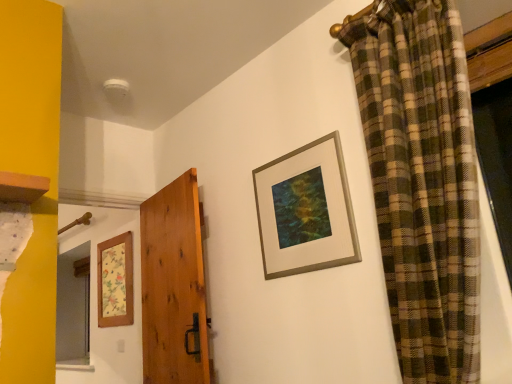
The width and height of the screenshot is (512, 384). What do you see at coordinates (174, 286) in the screenshot?
I see `natural wood door at center` at bounding box center [174, 286].

What do you see at coordinates (307, 210) in the screenshot? I see `gold metallic picture frame at upper center, marked as the 1th picture frame in a right-to-left arrangement` at bounding box center [307, 210].

What are the coordinates of `wooden floral-patterned picture frame at left, the 1th picture frame positioned from the bottom` in the screenshot? It's located at (115, 281).

This screenshot has width=512, height=384. I want to click on natural wood door at center, so click(x=174, y=286).

Is gold metallic picture frame at upper center, which is the 1th picture frame from top to bottom, surrounding natural wood door at center?

Definitely not — natural wood door at center is not inside gold metallic picture frame at upper center, which is the 1th picture frame from top to bottom.

You are a GUI agent. You are given a task and a screenshot of the screen. Output one action in this format:
    pyautogui.click(x=<x>, y=<y>)
    Task: Click on the door below the gold metallic picture frame at upper center, acting as the first picture frame starting from the front (from a real-world perspective)
    This screenshot has width=512, height=384.
    Given the screenshot: What is the action you would take?
    pyautogui.click(x=174, y=286)

Is gold metallic picture frame at upper center, which is the 1th picture frame from top to bottom, facing away from natural wood door at center?

That's not correct — gold metallic picture frame at upper center, which is the 1th picture frame from top to bottom, is not looking away from natural wood door at center.

Considering the relative sizes of gold metallic picture frame at upper center, the 2th picture frame from the left, and natural wood door at center in the image provided, is gold metallic picture frame at upper center, the 2th picture frame from the left, thinner than natural wood door at center?

Yes, gold metallic picture frame at upper center, the 2th picture frame from the left, is thinner than natural wood door at center.

Considering the relative sizes of natural wood door at center and wooden floral-patterned picture frame at left, the second picture frame in the front-to-back sequence, in the image provided, is natural wood door at center smaller than wooden floral-patterned picture frame at left, the second picture frame in the front-to-back sequence,?

Incorrect, natural wood door at center is not smaller in size than wooden floral-patterned picture frame at left, the second picture frame in the front-to-back sequence.

From the picture: Is natural wood door at center at the left side of wooden floral-patterned picture frame at left, the second picture frame in the front-to-back sequence?

In fact, natural wood door at center is to the right of wooden floral-patterned picture frame at left, the second picture frame in the front-to-back sequence.

Measure the distance between natural wood door at center and wooden floral-patterned picture frame at left, the 1th picture frame positioned from the left.

natural wood door at center is 23.34 inches away from wooden floral-patterned picture frame at left, the 1th picture frame positioned from the left.

Are natural wood door at center and wooden floral-patterned picture frame at left, the 1th picture frame positioned from the bottom, beside each other?

They are not placed beside each other.

Between wooden floral-patterned picture frame at left, the 1th picture frame positioned from the bottom, and natural wood door at center, which one has more height?

Standing taller between the two is natural wood door at center.

Based on the photo, considering the sizes of wooden floral-patterned picture frame at left, the 1th picture frame positioned from the back, and natural wood door at center in the image, is wooden floral-patterned picture frame at left, the 1th picture frame positioned from the back, wider or thinner than natural wood door at center?

Clearly, wooden floral-patterned picture frame at left, the 1th picture frame positioned from the back, has less width compared to natural wood door at center.

Considering the points (102, 317) and (169, 272), which point is behind, point (102, 317) or point (169, 272)?

The point (102, 317) is farther from the camera.

From the picture: Is gold metallic picture frame at upper center, marked as the 1th picture frame in a right-to-left arrangement, turned away from wooden floral-patterned picture frame at left, which ranks as the second picture frame in top-to-bottom order?

No.

What's the angular difference between gold metallic picture frame at upper center, the 2th picture frame from the left, and wooden floral-patterned picture frame at left, the 1th picture frame positioned from the back,'s facing directions?

They differ by 0.625 degrees in their facing directions.

Is gold metallic picture frame at upper center, acting as the first picture frame starting from the front, to the right of wooden floral-patterned picture frame at left, the second picture frame in the front-to-back sequence, from the viewer's perspective?

Indeed, gold metallic picture frame at upper center, acting as the first picture frame starting from the front, is positioned on the right side of wooden floral-patterned picture frame at left, the second picture frame in the front-to-back sequence.

Considering the relative sizes of gold metallic picture frame at upper center, marked as the 1th picture frame in a right-to-left arrangement, and wooden floral-patterned picture frame at left, which ranks as the second picture frame in top-to-bottom order, in the image provided, is gold metallic picture frame at upper center, marked as the 1th picture frame in a right-to-left arrangement, bigger than wooden floral-patterned picture frame at left, which ranks as the second picture frame in top-to-bottom order,?

No.

Is natural wood door at center positioned far away from gold metallic picture frame at upper center, the 2th picture frame positioned from the bottom?

Actually, natural wood door at center and gold metallic picture frame at upper center, the 2th picture frame positioned from the bottom, are a little close together.

From the image's perspective, is natural wood door at center located above gold metallic picture frame at upper center, which is the 1th picture frame from top to bottom?

No, from the image's perspective, natural wood door at center is not over gold metallic picture frame at upper center, which is the 1th picture frame from top to bottom.

Based on their sizes in the image, would you say natural wood door at center is bigger or smaller than gold metallic picture frame at upper center, the 2th picture frame from the left?

Considering their sizes, natural wood door at center takes up more space than gold metallic picture frame at upper center, the 2th picture frame from the left.

Can you confirm if natural wood door at center is taller than gold metallic picture frame at upper center, the 2th picture frame positioned from the bottom?

Yes, natural wood door at center is taller than gold metallic picture frame at upper center, the 2th picture frame positioned from the bottom.

Based on the photo, how many degrees apart are the facing directions of wooden floral-patterned picture frame at left, the second picture frame in the front-to-back sequence, and gold metallic picture frame at upper center, the 2th picture frame positioned from the bottom?

0.625 degrees separate the facing orientations of wooden floral-patterned picture frame at left, the second picture frame in the front-to-back sequence, and gold metallic picture frame at upper center, the 2th picture frame positioned from the bottom.

Considering the positions of objects wooden floral-patterned picture frame at left, the second picture frame in the front-to-back sequence, and gold metallic picture frame at upper center, the 2th picture frame from the left, in the image provided, who is more to the right, wooden floral-patterned picture frame at left, the second picture frame in the front-to-back sequence, or gold metallic picture frame at upper center, the 2th picture frame from the left,?

Positioned to the right is gold metallic picture frame at upper center, the 2th picture frame from the left.

Can you confirm if wooden floral-patterned picture frame at left, which is the second picture frame in right-to-left order, is taller than gold metallic picture frame at upper center, the 2th picture frame positioned from the bottom?

Correct, wooden floral-patterned picture frame at left, which is the second picture frame in right-to-left order, is much taller as gold metallic picture frame at upper center, the 2th picture frame positioned from the bottom.

Is wooden floral-patterned picture frame at left, which is the second picture frame in right-to-left order, oriented towards gold metallic picture frame at upper center, the 2th picture frame from the left?

No, wooden floral-patterned picture frame at left, which is the second picture frame in right-to-left order, is not oriented towards gold metallic picture frame at upper center, the 2th picture frame from the left.

Where is `door below the gold metallic picture frame at upper center, which is the 1th picture frame from top to bottom (from a real-world perspective)`? This screenshot has width=512, height=384. door below the gold metallic picture frame at upper center, which is the 1th picture frame from top to bottom (from a real-world perspective) is located at coordinates (174, 286).

Locate an element on the screen. The image size is (512, 384). picture frame below the natural wood door at center (from the image's perspective) is located at coordinates (115, 281).

When comparing their distances from gold metallic picture frame at upper center, the 2th picture frame positioned from the bottom, does natural wood door at center or wooden floral-patterned picture frame at left, which is the second picture frame in right-to-left order, seem closer?

natural wood door at center is positioned closer to the anchor gold metallic picture frame at upper center, the 2th picture frame positioned from the bottom.

Which object lies nearer to the anchor point wooden floral-patterned picture frame at left, the 1th picture frame positioned from the bottom, gold metallic picture frame at upper center, placed as the 2th picture frame when sorted from back to front, or natural wood door at center?

natural wood door at center is closer to wooden floral-patterned picture frame at left, the 1th picture frame positioned from the bottom.

From the image, which object appears to be nearer to gold metallic picture frame at upper center, the 2th picture frame from the left, wooden floral-patterned picture frame at left, the second picture frame in the front-to-back sequence, or natural wood door at center?

Among the two, natural wood door at center is located nearer to gold metallic picture frame at upper center, the 2th picture frame from the left.

Which object lies further to the anchor point wooden floral-patterned picture frame at left, the 1th picture frame positioned from the bottom, natural wood door at center or gold metallic picture frame at upper center, which is the 1th picture frame from top to bottom?

gold metallic picture frame at upper center, which is the 1th picture frame from top to bottom, lies further to wooden floral-patterned picture frame at left, the 1th picture frame positioned from the bottom, than the other object.

From the picture: Which object lies nearer to the anchor point natural wood door at center, wooden floral-patterned picture frame at left, the 1th picture frame positioned from the back, or gold metallic picture frame at upper center, the 2th picture frame from the left?

wooden floral-patterned picture frame at left, the 1th picture frame positioned from the back, lies closer to natural wood door at center than the other object.

Looking at the image, which one is located closer to natural wood door at center, gold metallic picture frame at upper center, marked as the 1th picture frame in a right-to-left arrangement, or wooden floral-patterned picture frame at left, the 1th picture frame positioned from the bottom?

Among the two, wooden floral-patterned picture frame at left, the 1th picture frame positioned from the bottom, is located nearer to natural wood door at center.

The width and height of the screenshot is (512, 384). I want to click on door located between gold metallic picture frame at upper center, the 2th picture frame from the left, and wooden floral-patterned picture frame at left, the 1th picture frame positioned from the back, in the depth direction, so click(x=174, y=286).